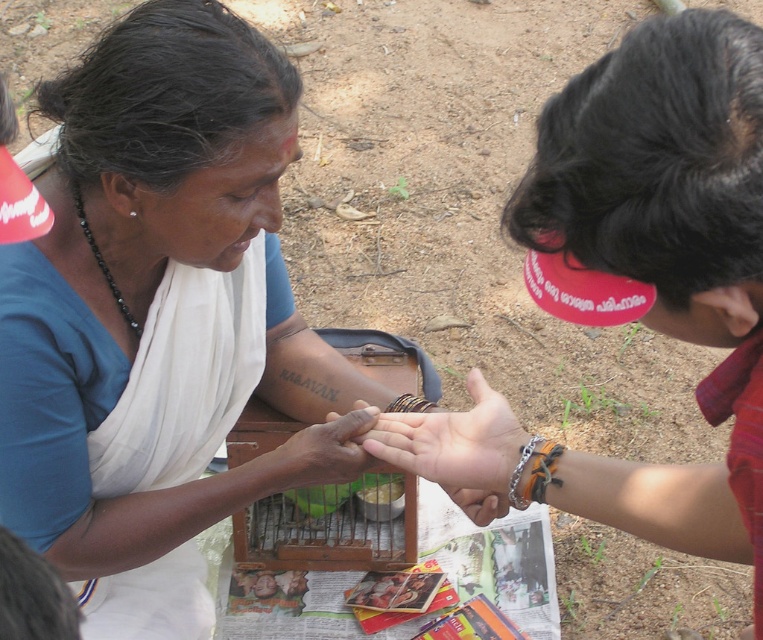
You are a photographer trying to capture a closeup shot of both the smooth skin hand at center and the brown leather bracelet at center. Given that your camera can only focus on one object at a time, which object should you focus on to ensure it appears clearer in the photo?

The smooth skin hand at center is bigger than the brown leather bracelet at center, so focusing on the smooth skin hand at center will ensure it appears clearer in the photo.